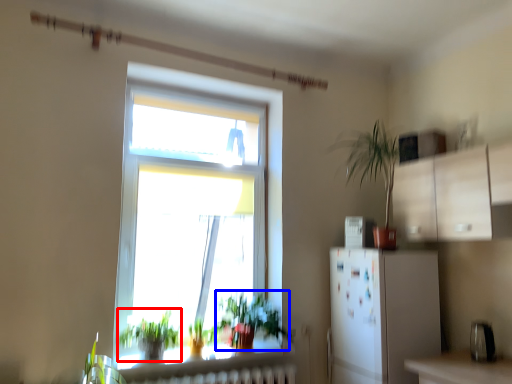
Question: Which point is closer to the camera, vegetation (highlighted by a red box) or vegetation (highlighted by a blue box)?

Choices:
 (A) vegetation
 (B) vegetation

Answer: (A)